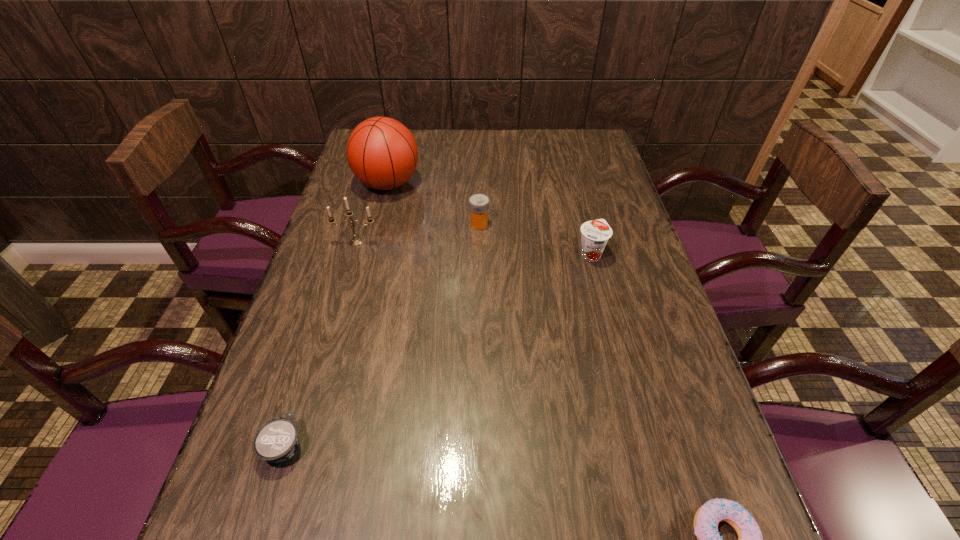
This screenshot has height=540, width=960. Identify the location of vacant position located 0.200m on the right of the second tallest object. (453, 242).

Locate an element on the screen. The height and width of the screenshot is (540, 960). vacant space located on the label side of the second farthest object is located at coordinates (574, 224).

Where is `vacant area situated on the left of the right yogurt`? This screenshot has width=960, height=540. vacant area situated on the left of the right yogurt is located at coordinates (x=538, y=254).

The width and height of the screenshot is (960, 540). I want to click on vacant region located 0.150m on the back of the left yogurt, so click(312, 356).

Find the location of a particular element. This screenshot has height=540, width=960. basketball that is at the left edge is located at coordinates (382, 153).

Find the location of a particular element. The width and height of the screenshot is (960, 540). candle that is positioned at the left edge is located at coordinates (356, 241).

Find the location of `yogurt that is at the left edge`. yogurt that is at the left edge is located at coordinates (276, 441).

Locate an element on the screen. object that is at the right edge is located at coordinates (595, 234).

The height and width of the screenshot is (540, 960). In order to click on free location at the far edge of the desktop in this screenshot , I will do `click(493, 143)`.

Find the location of a particular element. The width and height of the screenshot is (960, 540). free location at the left edge is located at coordinates (382, 207).